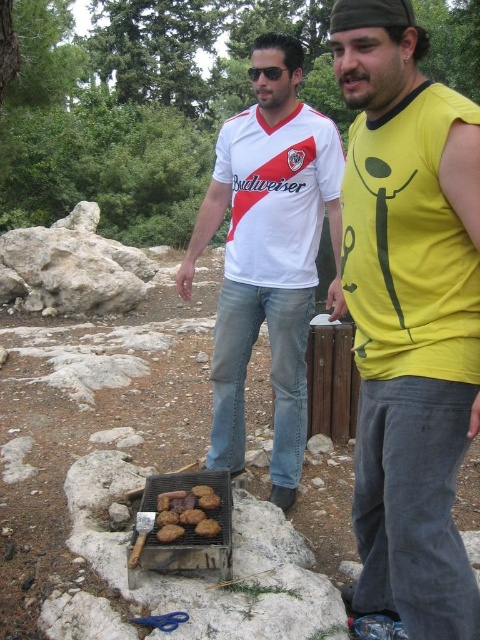
You are standing at the camera position and want to reach the point marked as point (x=380, y=588). Is this point within your immediate reach without moving your feet?

The point marked as point (x=380, y=588) is 1.86 meters away from the camera, so it is outside of immediate reach without moving your feet.

You are standing at the point marked as point (409, 316) in the image. What is the nearest object to you?

The nearest object to point (409, 316) is the yellow matte shirt at center.